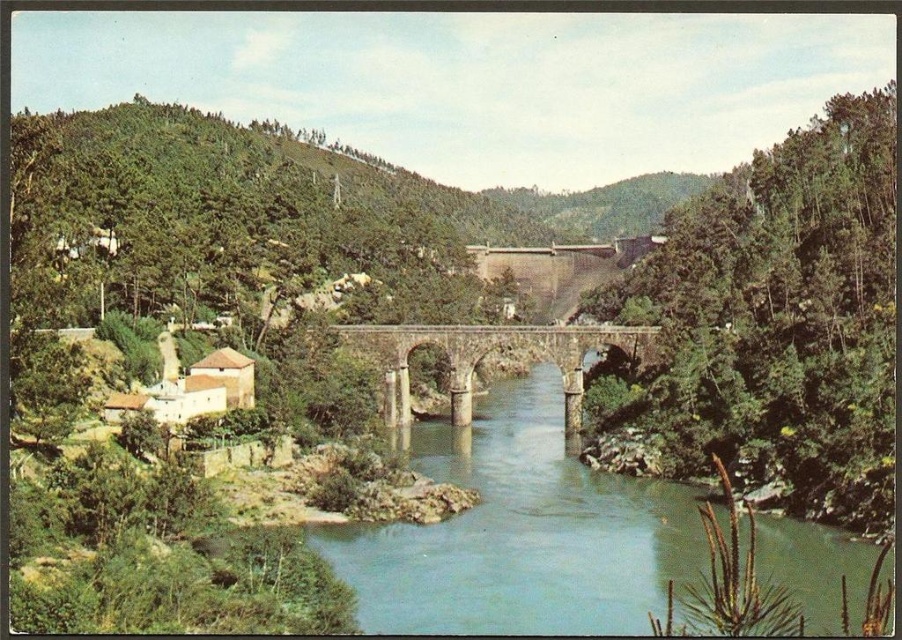
Question: Does green stone river at center come in front of stone arch bridge at center?

Choices:
 (A) no
 (B) yes

Answer: (B)

Question: Can you confirm if green stone river at center is positioned to the left of stone arch bridge at center?

Choices:
 (A) yes
 (B) no

Answer: (A)

Question: Which point is farther to the camera?

Choices:
 (A) green stone river at center
 (B) stone arch bridge at center

Answer: (B)

Question: Which point is closer to the camera?

Choices:
 (A) green stone river at center
 (B) stone arch bridge at center

Answer: (A)

Question: Is green stone river at center smaller than stone arch bridge at center?

Choices:
 (A) no
 (B) yes

Answer: (A)